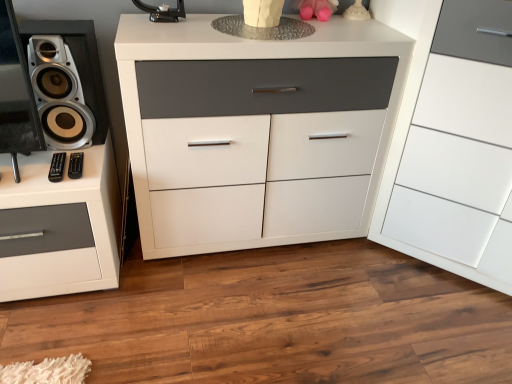
You are a GUI agent. You are given a task and a screenshot of the screen. Output one action in this format:
    pyautogui.click(x=<x>, y=<y>)
    Task: Click on the free space in front of white matte chest of drawers at center, which is the first chest of drawers from left to right
    The image size is (512, 384).
    Given the screenshot: What is the action you would take?
    pyautogui.click(x=238, y=311)